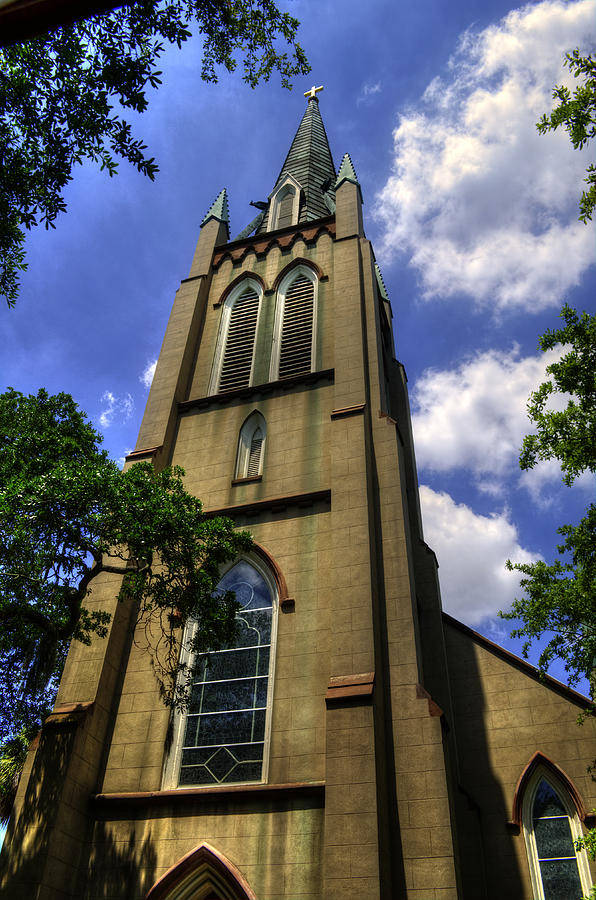
At what (x,y) coordinates should I click in order to perform the action: click on tiles. Please return your answer as a coordinate pair (x, y). This screenshot has height=900, width=596. Looking at the image, I should click on (313, 132), (222, 205), (347, 166).